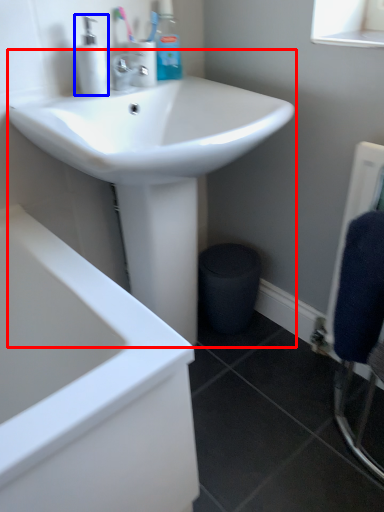
Question: Among these objects, which one is nearest to the camera, sink (highlighted by a red box) or soap dispenser (highlighted by a blue box)?

Choices:
 (A) sink
 (B) soap dispenser

Answer: (A)